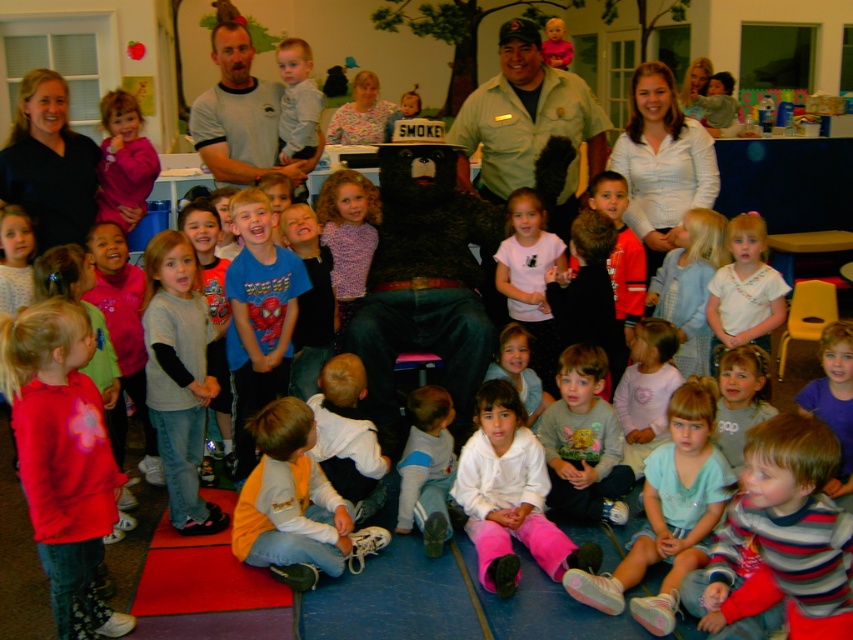
You are organizing a clothing donation drive and need to determine which item takes up more space. Which of the two pink items, the matte pink sweatshirt at lower left or the matte pink sweater at left, is wider?

The matte pink sweatshirt at lower left is wider than the matte pink sweater at left.

You are standing at the center of the image. Where is the pink fabric pants at lower right located relative to your position?

The pink fabric pants at lower right is located at the lower right of the image, specifically at point coordinates of (x=669, y=513).